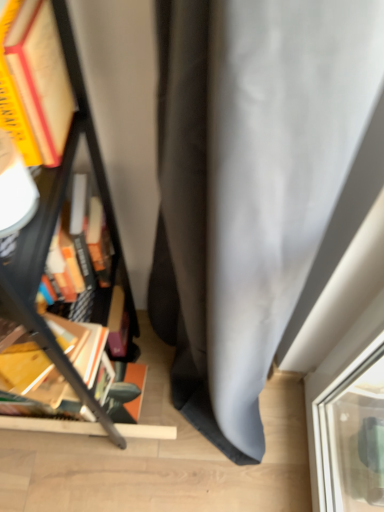
The height and width of the screenshot is (512, 384). Describe the element at coordinates (53, 228) in the screenshot. I see `matte black bookcase at left` at that location.

The width and height of the screenshot is (384, 512). In order to click on matte black bookcase at left in this screenshot , I will do click(53, 228).

What do you see at coordinates (110, 378) in the screenshot? I see `wooden book at left` at bounding box center [110, 378].

Measure the distance between wooden book at left and camera.

76.66 centimeters.

Identify the location of wooden book at left. (110, 378).

Where is `matte black bookcase at left`? The image size is (384, 512). matte black bookcase at left is located at coordinates (53, 228).

Considering the relative positions of matte black bookcase at left and wooden book at left in the image provided, is matte black bookcase at left to the left or to the right of wooden book at left?

Based on their positions, matte black bookcase at left is located to the left of wooden book at left.

Consider the image. Which is behind, matte black bookcase at left or wooden book at left?

wooden book at left is further away from the camera.

Considering the positions of point (14, 301) and point (103, 384), is point (14, 301) closer or farther from the camera than point (103, 384)?

Point (14, 301).

From the image's perspective, is matte black bookcase at left above or below wooden book at left?

Clearly, from the image's perspective, matte black bookcase at left is above wooden book at left.

From a real-world perspective, is matte black bookcase at left beneath wooden book at left?

Indeed, from a real-world perspective, matte black bookcase at left is positioned beneath wooden book at left.

Is matte black bookcase at left wider or thinner than wooden book at left?

In the image, matte black bookcase at left appears to be wider than wooden book at left.

Who is shorter, matte black bookcase at left or wooden book at left?

With less height is wooden book at left.

Considering the sizes of objects matte black bookcase at left and wooden book at left in the image provided, who is bigger, matte black bookcase at left or wooden book at left?

Bigger between the two is matte black bookcase at left.

Can wooden book at left be found inside matte black bookcase at left?

Yes, wooden book at left is a part of matte black bookcase at left.

Are matte black bookcase at left and wooden book at left located far from each other?

That's not correct — matte black bookcase at left is a little close to wooden book at left.

Is matte black bookcase at left aimed at wooden book at left?

Yes, matte black bookcase at left is turned towards wooden book at left.

Can you tell me how much matte black bookcase at left and wooden book at left differ in facing direction?

The facing directions of matte black bookcase at left and wooden book at left are 7.03 degrees apart.

At what (x,y) coordinates should I click in order to perform the action: click on book that appears on the right of matte black bookcase at left. Please return your answer as a coordinate pair (x, y). The width and height of the screenshot is (384, 512). Looking at the image, I should click on (110, 378).

Does wooden book at left appear on the right side of matte black bookcase at left?

Yes, wooden book at left is to the right of matte black bookcase at left.

In the image, is wooden book at left positioned in front of or behind matte black bookcase at left?

In the image, wooden book at left appears behind matte black bookcase at left.

Is point (83, 368) positioned after point (47, 334)?

Yes.

From the image's perspective, is wooden book at left above or below matte black bookcase at left?

wooden book at left is situated lower than matte black bookcase at left in the image.

From a real-world perspective, which is physically above, wooden book at left or matte black bookcase at left?

wooden book at left, from a real-world perspective.

Does wooden book at left have a lesser width compared to matte black bookcase at left?

Yes.

Is wooden book at left taller or shorter than matte black bookcase at left?

In the image, wooden book at left appears to be shorter than matte black bookcase at left.

Can you confirm if wooden book at left is bigger than matte black bookcase at left?

Actually, wooden book at left might be smaller than matte black bookcase at left.

Is wooden book at left not inside matte black bookcase at left?

No, wooden book at left is inside or overlapping with matte black bookcase at left.

In the scene shown: Is wooden book at left with matte black bookcase at left?

There is a gap between wooden book at left and matte black bookcase at left.

Is wooden book at left positioned with its back to matte black bookcase at left?

Yes.

What's the angular difference between wooden book at left and matte black bookcase at left's facing directions?

There is a 7.03-degree angle between the facing directions of wooden book at left and matte black bookcase at left.

This screenshot has width=384, height=512. Identify the location of bookcase that is above the wooden book at left (from the image's perspective). (53, 228).

Identify the location of book behind the matte black bookcase at left. This screenshot has height=512, width=384. (110, 378).

You are a GUI agent. You are given a task and a screenshot of the screen. Output one action in this format:
    pyautogui.click(x=<x>, y=<y>)
    Task: Click on the book below the matte black bookcase at left (from the image's perspective)
    The image size is (384, 512).
    Given the screenshot: What is the action you would take?
    pyautogui.click(x=110, y=378)